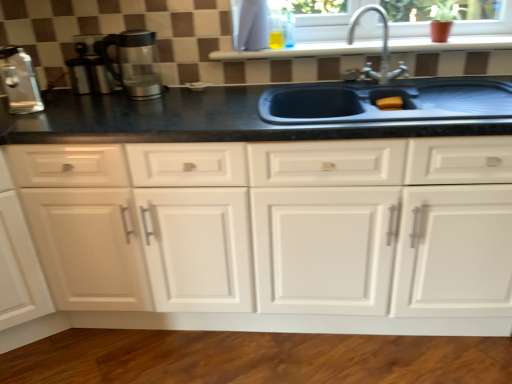
Identify the location of vacant space to the right of satin nickel faucet at upper right. The width and height of the screenshot is (512, 384). (424, 98).